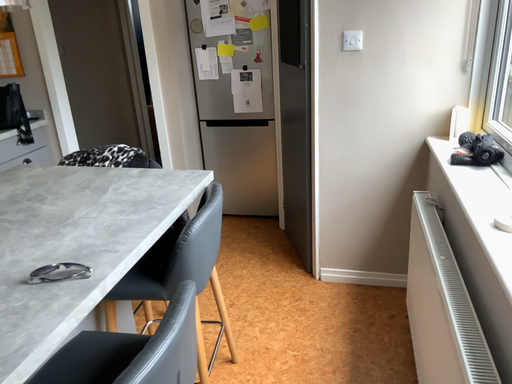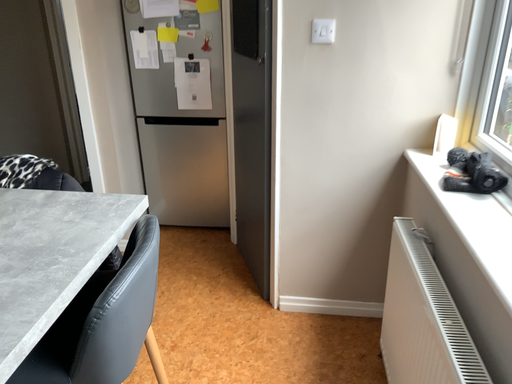
Question: Which way did the camera rotate in the video?

Choices:
 (A) rotated left
 (B) rotated right

Answer: (B)